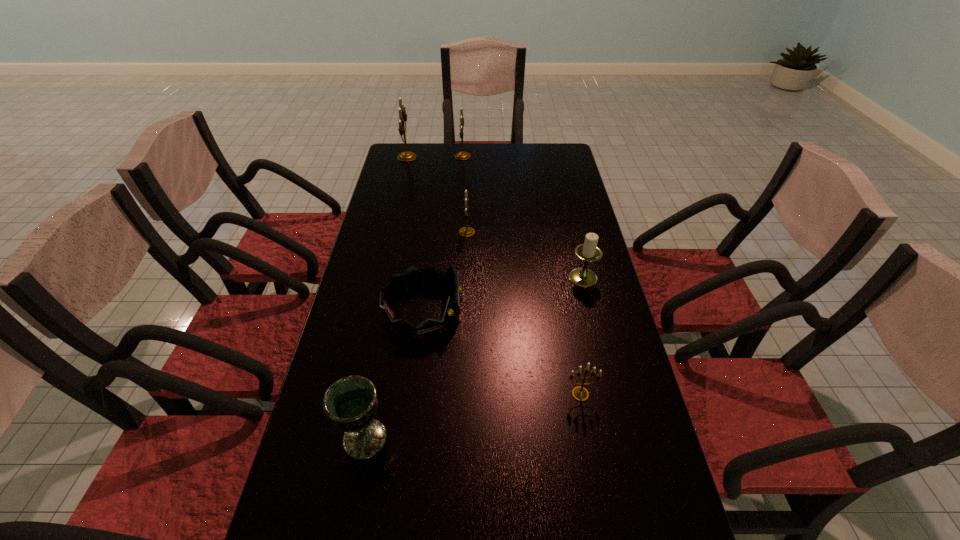
Locate an element on the screen. This screenshot has height=540, width=960. the smallest gold candelabrum is located at coordinates (579, 393).

What are the coordinates of `blank space located 0.170m on the right of the tallest object` in the screenshot? It's located at (458, 157).

Find the location of a particular element. This screenshot has height=540, width=960. free space located 0.220m on the left of the third smallest gold candelabrum is located at coordinates (402, 157).

I want to click on vacant space positioned on the back of the third farthest candelabrum, so click(x=468, y=215).

Locate an element on the screen. The height and width of the screenshot is (540, 960). vacant space located 0.330m on the left of the fourth farthest candelabrum is located at coordinates (458, 278).

Locate an element on the screen. The height and width of the screenshot is (540, 960). free space located 0.060m on the front of the chalice is located at coordinates (354, 491).

Locate an element on the screen. vacant region located at the front of the red tiara with jewels is located at coordinates (x=542, y=312).

What are the coordinates of `vacant region located 0.250m on the front of the smallest gold candelabrum` in the screenshot? It's located at (603, 519).

Where is `candelabrum at the left edge`? Image resolution: width=960 pixels, height=540 pixels. candelabrum at the left edge is located at coordinates (406, 156).

The image size is (960, 540). Find the location of `chalice at the left edge`. chalice at the left edge is located at coordinates (350, 403).